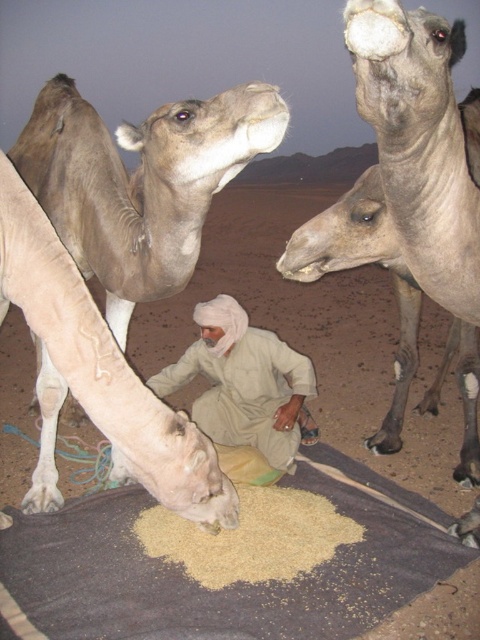
Question: Which object is farther from the camera taking this photo?

Choices:
 (A) gray matte camel at upper right
 (B) light beige cotton clothing at center
 (C) brown grain at lower center
 (D) light brown fur at center

Answer: (B)

Question: Which point is closer to the camera?

Choices:
 (A) (206, 538)
 (B) (400, 305)
 (C) (245, 97)
 (D) (194, 314)

Answer: (C)

Question: Is gray matte camel at upper right above brown grain at lower center?

Choices:
 (A) no
 (B) yes

Answer: (B)

Question: Which point is closer to the camera?

Choices:
 (A) brown grain at lower center
 (B) light beige cotton clothing at center
 (C) light brown fur at center

Answer: (C)

Question: Can you confirm if gray matte camel at upper right is positioned below brown grain at lower center?

Choices:
 (A) no
 (B) yes

Answer: (A)

Question: In this image, where is gray matte camel at upper right located relative to brown grain at lower center?

Choices:
 (A) left
 (B) right

Answer: (B)